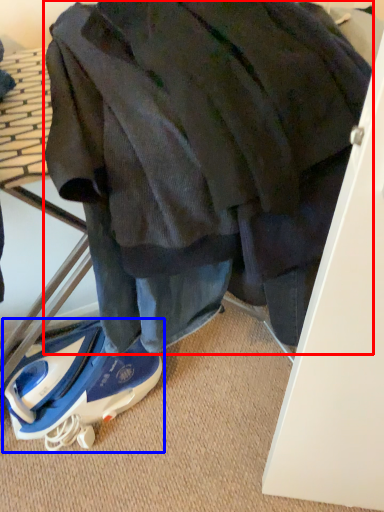
Question: Among these objects, which one is farthest to the camera, jacket (highlighted by a red box) or footwear (highlighted by a blue box)?

Choices:
 (A) jacket
 (B) footwear

Answer: (B)